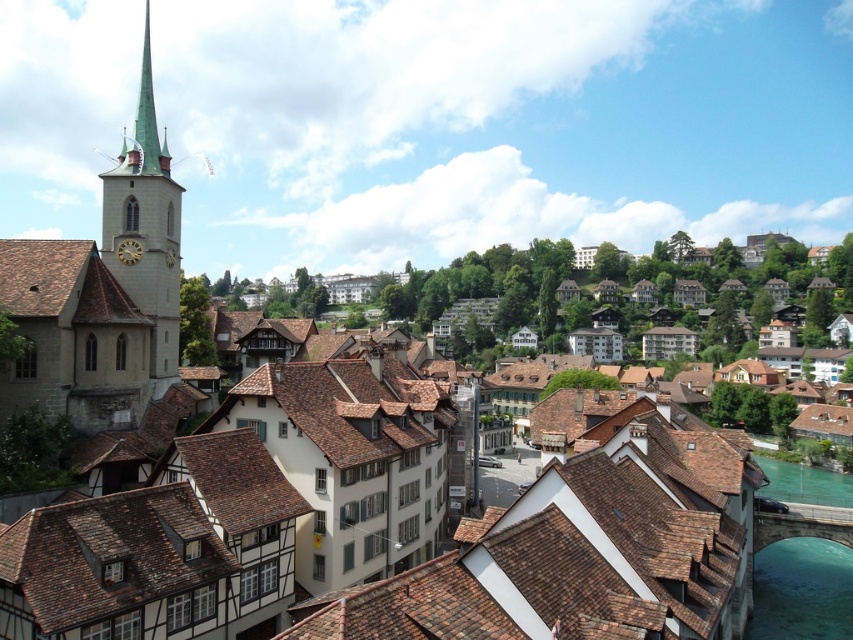
Can you confirm if green spire at left is wider than green copper spire at upper left?

No.

Is point (144, 29) closer to viewer compared to point (151, 124)?

No.

Locate an element on the screen. green spire at left is located at coordinates (146, 228).

Does clear blue water at lower right appear under green copper spire at upper left?

Yes, clear blue water at lower right is below green copper spire at upper left.

Is clear blue water at lower right behind green copper spire at upper left?

No, clear blue water at lower right is in front of green copper spire at upper left.

Locate an element on the screen. The width and height of the screenshot is (853, 640). clear blue water at lower right is located at coordinates (802, 592).

Does brown tile roof at center have a smaller size compared to green spire at left?

Indeed, brown tile roof at center has a smaller size compared to green spire at left.

Can you confirm if brown tile roof at center is thinner than green spire at left?

Yes.

Is point (494, 531) less distant than point (148, 298)?

Yes, point (494, 531) is closer to viewer.

I want to click on brown tile roof at center, so click(583, 550).